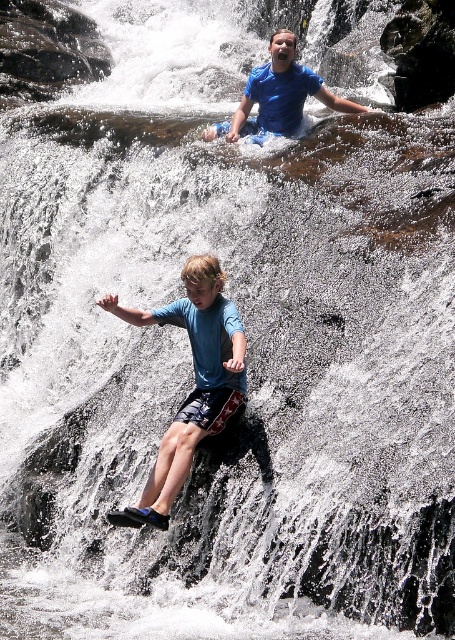
Question: Does blue fabric shorts at center appear over blue cotton shirt at upper center?

Choices:
 (A) yes
 (B) no

Answer: (B)

Question: Observing the image, what is the correct spatial positioning of blue fabric shorts at center in reference to blue cotton shirt at upper center?

Choices:
 (A) left
 (B) right

Answer: (A)

Question: Does blue fabric shorts at center appear under blue cotton shirt at upper center?

Choices:
 (A) no
 (B) yes

Answer: (B)